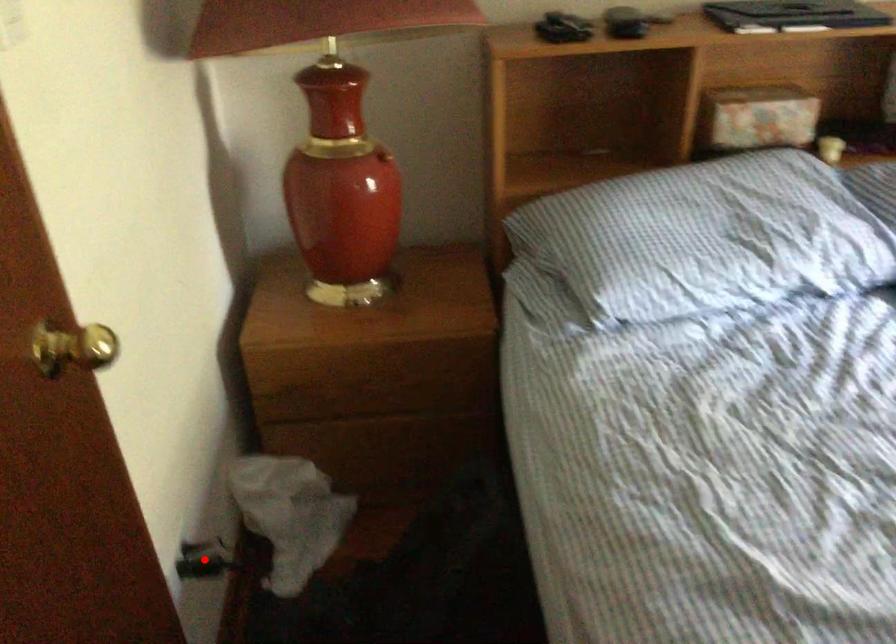
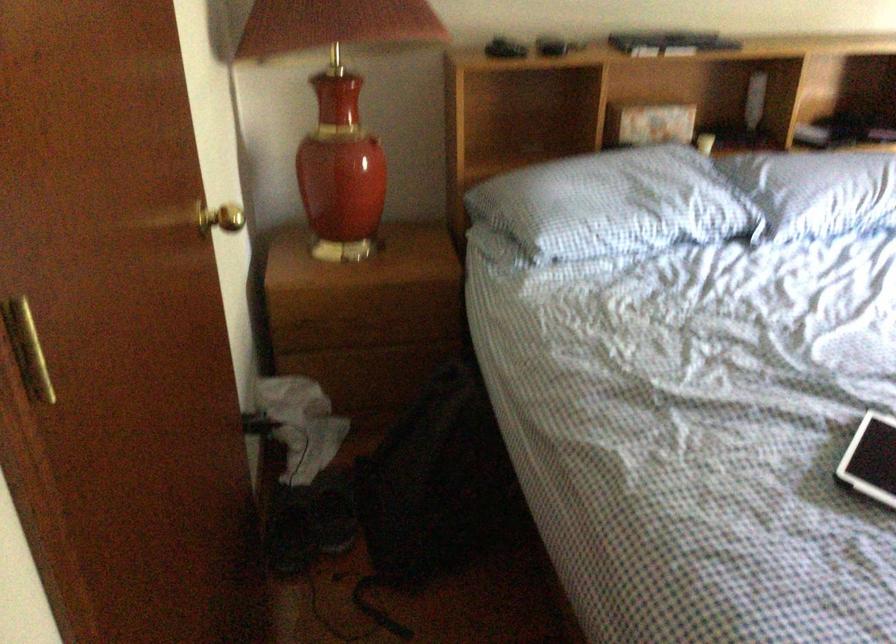
Question: I am providing you with two images of the same scene from different viewpoints. A red point is marked on the first image. At the location where the point appears in image 1, is it still visible in image 2?

Choices:
 (A) Yes
 (B) No

Answer: (B)